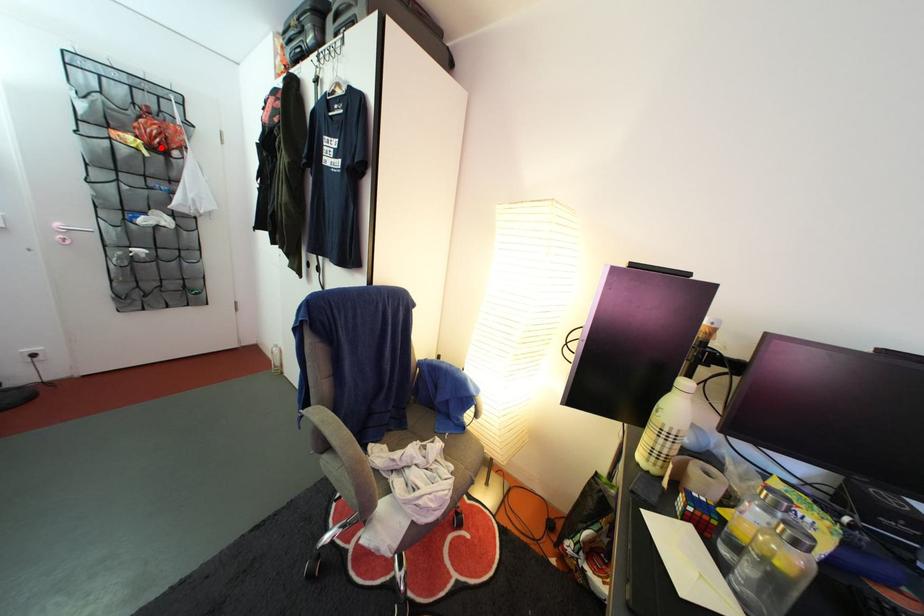
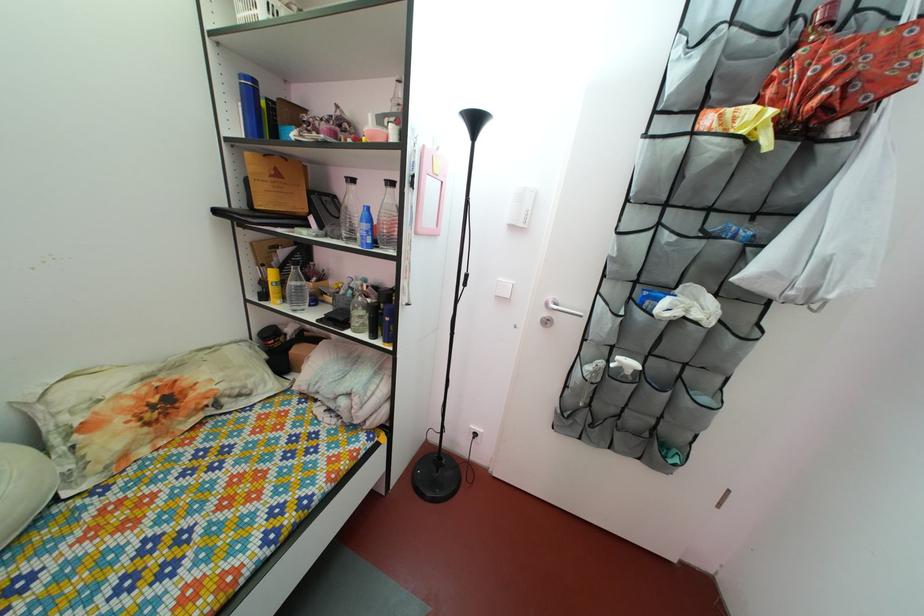
Find the pixel in the second image that matches the highlighted location in the first image.

(816, 103)